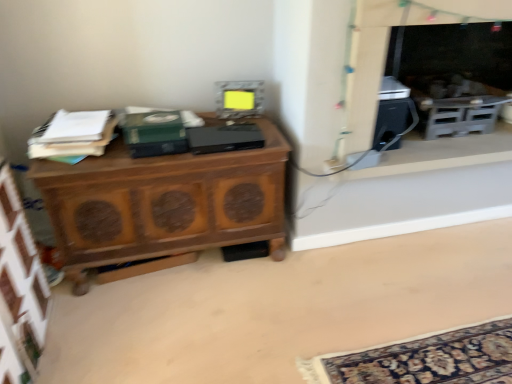
Describe the element at coordinates (440, 154) in the screenshot. I see `black plastic speaker at right` at that location.

Measure the distance between dark gray stone fireplace at upper right, the second fireplace in the front-to-back sequence, and camera.

They are 2.04 meters apart.

Find the location of `dark gray stone fireplace at upper right, the second fireplace in the front-to-back sequence`. dark gray stone fireplace at upper right, the second fireplace in the front-to-back sequence is located at coordinates (453, 73).

Locate an element on the screen. This screenshot has width=512, height=384. wooden cabinet at lower left is located at coordinates (277, 309).

I want to click on green matte book at center, which is the 2th book in left-to-right order, so click(155, 134).

Where is `white paper stack at left, the 2th book positioned from the right`? The width and height of the screenshot is (512, 384). white paper stack at left, the 2th book positioned from the right is located at coordinates (75, 136).

Image resolution: width=512 pixels, height=384 pixels. I want to click on wooden cabinet at left, so [164, 203].

This screenshot has height=384, width=512. Find the location of `matte black fireplace at upper right, the second fireplace from the back`. matte black fireplace at upper right, the second fireplace from the back is located at coordinates (387, 50).

This screenshot has width=512, height=384. What do you see at coordinates (387, 50) in the screenshot? I see `matte black fireplace at upper right, the second fireplace from the back` at bounding box center [387, 50].

Where is `matte gray microwave at center`? matte gray microwave at center is located at coordinates point(239,99).

Can you confirm if dark gray stone fireplace at upper right, positioned as the first fireplace in back-to-front order, is positioned to the right of white paper stack at left, which appears as the first book when viewed from the left?

Yes.

Which object is wider, dark gray stone fireplace at upper right, the second fireplace in the front-to-back sequence, or white paper stack at left, the 2th book positioned from the right?

dark gray stone fireplace at upper right, the second fireplace in the front-to-back sequence, is wider.

Consider the image. What's the angular difference between dark gray stone fireplace at upper right, the second fireplace in the front-to-back sequence, and white paper stack at left, which appears as the first book when viewed from the left,'s facing directions?

They differ by 9.87 degrees in their facing directions.

Locate an element on the screen. The height and width of the screenshot is (384, 512). window sill beneath the green matte book at center, which is the 2th book in left-to-right order (from a real-world perspective) is located at coordinates (440, 154).

From a real-world perspective, is green matte book at center, the first book in the right-to-left sequence, positioned above or below black plastic speaker at right?

From a real-world perspective, green matte book at center, the first book in the right-to-left sequence, is physically above black plastic speaker at right.

Based on the photo, is green matte book at center, the first book in the right-to-left sequence, in front of or behind black plastic speaker at right in the image?

green matte book at center, the first book in the right-to-left sequence, is in front of black plastic speaker at right.

From the image's perspective, is green matte book at center, the first book in the right-to-left sequence, located above or below black plastic speaker at right?

Based on their image positions, green matte book at center, the first book in the right-to-left sequence, is located beneath black plastic speaker at right.

How many degrees apart are the facing directions of matte black fireplace at upper right, the first fireplace from the front, and white paper stack at left, which appears as the first book when viewed from the left?

The angular difference between matte black fireplace at upper right, the first fireplace from the front, and white paper stack at left, which appears as the first book when viewed from the left, is 9.43 degrees.

From a real-world perspective, is matte black fireplace at upper right, the second fireplace from the back, under white paper stack at left, which appears as the first book when viewed from the left?

Actually, matte black fireplace at upper right, the second fireplace from the back, is physically above white paper stack at left, which appears as the first book when viewed from the left, in the real world.

Is matte black fireplace at upper right, the second fireplace from the back, in front of white paper stack at left, which appears as the first book when viewed from the left?

Yes, matte black fireplace at upper right, the second fireplace from the back, is in front of white paper stack at left, which appears as the first book when viewed from the left.

Is matte black fireplace at upper right, the second fireplace from the back, bigger than white paper stack at left, which appears as the first book when viewed from the left?

Indeed, matte black fireplace at upper right, the second fireplace from the back, has a larger size compared to white paper stack at left, which appears as the first book when viewed from the left.

Can you confirm if wooden cabinet at left is taller than wooden cabinet at lower left?

Yes.

Which object is closer to the camera taking this photo, wooden cabinet at left or wooden cabinet at lower left?

wooden cabinet at lower left.

In terms of width, does wooden cabinet at left look wider or thinner when compared to wooden cabinet at lower left?

In the image, wooden cabinet at left appears to be more narrow than wooden cabinet at lower left.

Is wooden cabinet at left located outside wooden cabinet at lower left?

wooden cabinet at left is positioned outside wooden cabinet at lower left.

Is matte black fireplace at upper right, the first fireplace from the front, not close to matte gray microwave at center?

No, matte black fireplace at upper right, the first fireplace from the front, is in close proximity to matte gray microwave at center.

How far apart are matte black fireplace at upper right, the second fireplace from the back, and matte gray microwave at center?

matte black fireplace at upper right, the second fireplace from the back, and matte gray microwave at center are 26.15 inches apart from each other.

Between matte black fireplace at upper right, the second fireplace from the back, and matte gray microwave at center, which one has less height?

matte gray microwave at center is shorter.

Considering the sizes of matte black fireplace at upper right, the first fireplace from the front, and matte gray microwave at center in the image, is matte black fireplace at upper right, the first fireplace from the front, wider or thinner than matte gray microwave at center?

Considering their sizes, matte black fireplace at upper right, the first fireplace from the front, looks broader than matte gray microwave at center.

Is wooden cabinet at left oriented away from matte gray microwave at center?

wooden cabinet at left does not have its back to matte gray microwave at center.

In the scene shown: Between wooden cabinet at left and matte gray microwave at center, which one is positioned in front?

wooden cabinet at left.

Based on their sizes in the image, would you say wooden cabinet at left is bigger or smaller than matte gray microwave at center?

In the image, wooden cabinet at left appears to be larger than matte gray microwave at center.

Does wooden cabinet at left contain matte gray microwave at center?

Actually, matte gray microwave at center is outside wooden cabinet at left.

Is matte gray microwave at center next to matte black fireplace at upper right, the first fireplace from the front?

No, matte gray microwave at center is not with matte black fireplace at upper right, the first fireplace from the front.

Does matte gray microwave at center appear on the right side of matte black fireplace at upper right, the second fireplace from the back?

Incorrect, matte gray microwave at center is not on the right side of matte black fireplace at upper right, the second fireplace from the back.

Does matte gray microwave at center have a greater height compared to matte black fireplace at upper right, the second fireplace from the back?

No, matte gray microwave at center is not taller than matte black fireplace at upper right, the second fireplace from the back.

Considering the positions of objects matte gray microwave at center and matte black fireplace at upper right, the first fireplace from the front, in the image provided, who is behind, matte gray microwave at center or matte black fireplace at upper right, the first fireplace from the front,?

matte gray microwave at center is behind.

Locate an element on the screen. This screenshot has height=384, width=512. the 2nd fireplace to the right of the white paper stack at left, the 2th book positioned from the right, counting from the anchor's position is located at coordinates (453, 73).

Which book is the 1st one when counting from the left side of the black plastic speaker at right? Please provide its 2D coordinates.

[(155, 134)]

Estimate the real-world distances between objects in this image. Which object is closer to green matte book at center, the first book in the right-to-left sequence, matte gray microwave at center or wooden cabinet at lower left?

Among the two, matte gray microwave at center is located nearer to green matte book at center, the first book in the right-to-left sequence.

Based on their spatial positions, is white paper stack at left, the 2th book positioned from the right, or green matte book at center, which is the 2th book in left-to-right order, closer to matte black fireplace at upper right, the second fireplace from the back?

green matte book at center, which is the 2th book in left-to-right order, is positioned closer to the anchor matte black fireplace at upper right, the second fireplace from the back.

Estimate the real-world distances between objects in this image. Which object is further from wooden cabinet at left, white paper stack at left, the 2th book positioned from the right, or matte black fireplace at upper right, the second fireplace from the back?

The object further to wooden cabinet at left is matte black fireplace at upper right, the second fireplace from the back.

Based on their spatial positions, is white paper stack at left, which appears as the first book when viewed from the left, or matte black fireplace at upper right, the first fireplace from the front, further from wooden cabinet at lower left?

Among the two, white paper stack at left, which appears as the first book when viewed from the left, is located further to wooden cabinet at lower left.

Looking at the image, which one is located closer to matte gray microwave at center, black plastic speaker at right or white paper stack at left, which appears as the first book when viewed from the left?

white paper stack at left, which appears as the first book when viewed from the left, lies closer to matte gray microwave at center than the other object.

In the scene shown: Considering their positions, is green matte book at center, the first book in the right-to-left sequence, positioned closer to matte black fireplace at upper right, the second fireplace from the back, than white paper stack at left, which appears as the first book when viewed from the left?

green matte book at center, the first book in the right-to-left sequence.

From the image, which object appears to be farther from matte gray microwave at center, matte black fireplace at upper right, the first fireplace from the front, or white paper stack at left, the 2th book positioned from the right?

The object further to matte gray microwave at center is matte black fireplace at upper right, the first fireplace from the front.

Considering their positions, is matte black fireplace at upper right, the first fireplace from the front, positioned further to matte gray microwave at center than wooden cabinet at lower left?

wooden cabinet at lower left.

Identify the location of fireplace situated between green matte book at center, which is the 2th book in left-to-right order, and black plastic speaker at right from left to right. (x=387, y=50).

Find the location of `appliance between wooden cabinet at left and matte black fireplace at upper right, the second fireplace from the back, in the horizontal direction`. appliance between wooden cabinet at left and matte black fireplace at upper right, the second fireplace from the back, in the horizontal direction is located at coordinates (239, 99).

Find the location of `appliance between white paper stack at left, which appears as the first book when viewed from the left, and dark gray stone fireplace at upper right, positioned as the first fireplace in back-to-front order`. appliance between white paper stack at left, which appears as the first book when viewed from the left, and dark gray stone fireplace at upper right, positioned as the first fireplace in back-to-front order is located at coordinates (239, 99).

Identify the location of plain situated between green matte book at center, the first book in the right-to-left sequence, and black plastic speaker at right from left to right. (277, 309).